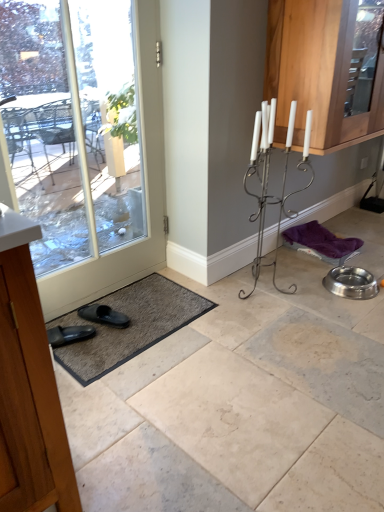
Where is `vacant space in front of metallic silver candle holder at center right`? This screenshot has width=384, height=512. vacant space in front of metallic silver candle holder at center right is located at coordinates coord(266,323).